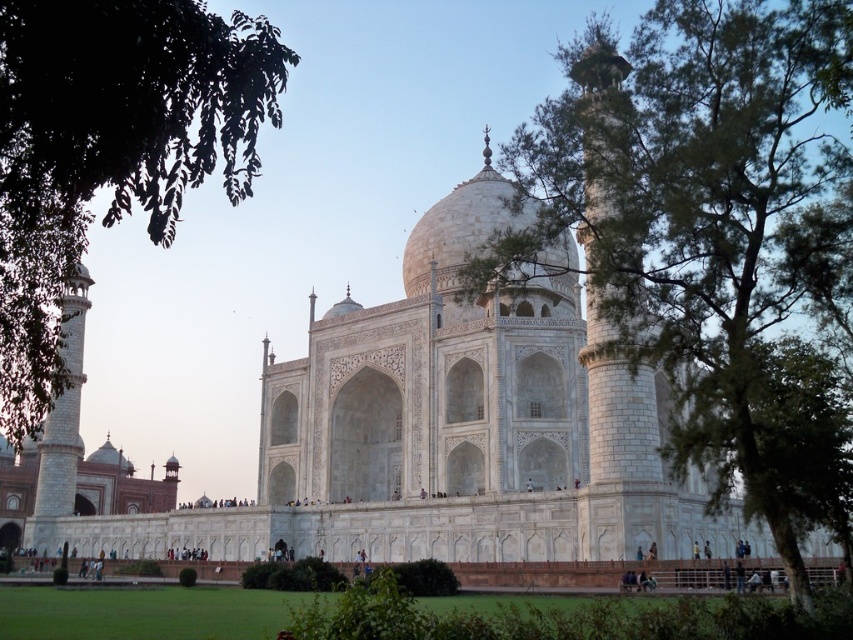
Question: Is green leafy tree at center bigger than green leafy tree at upper left?

Choices:
 (A) no
 (B) yes

Answer: (A)

Question: Does green leafy tree at center appear on the right side of green leafy tree at upper left?

Choices:
 (A) yes
 (B) no

Answer: (A)

Question: Which object appears closest to the camera in this image?

Choices:
 (A) green leafy tree at center
 (B) green leafy tree at upper left

Answer: (B)

Question: In this image, where is green leafy tree at center located relative to green leafy tree at upper left?

Choices:
 (A) above
 (B) below

Answer: (B)

Question: Which point is farther to the camera?

Choices:
 (A) green leafy tree at upper left
 (B) green leafy tree at center

Answer: (B)